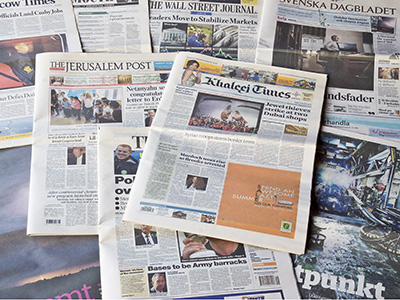
Locate an element on the screen. Image resolution: width=400 pixels, height=300 pixels. newspapers is located at coordinates (98, 9), (37, 23), (200, 27), (326, 37), (275, 114), (107, 110), (153, 265), (353, 243).